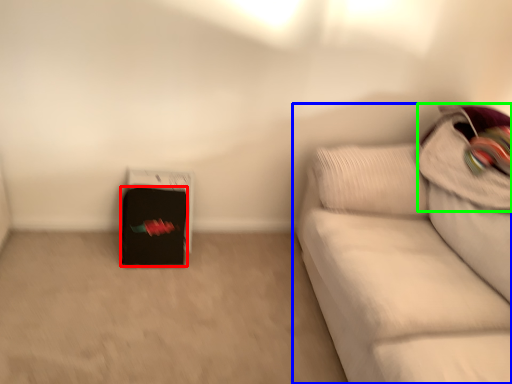
Question: Considering the real-world distances, which object is closest to luggage (highlighted by a red box)? studio couch (highlighted by a blue box) or pillow (highlighted by a green box).

Choices:
 (A) studio couch
 (B) pillow

Answer: (A)